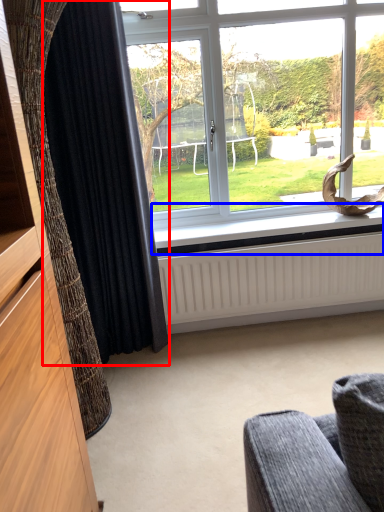
Question: Which object appears closest to the camera in this image, curtain (highlighted by a red box) or window sill (highlighted by a blue box)?

Choices:
 (A) curtain
 (B) window sill

Answer: (A)